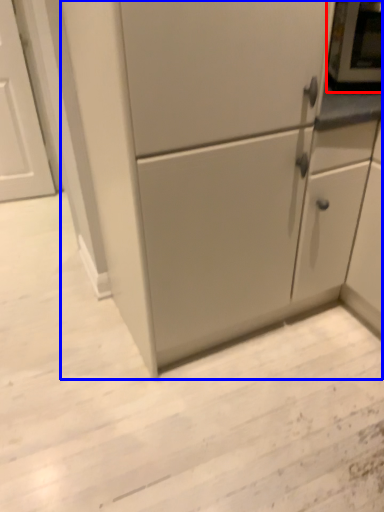
Question: Which point is further to the camera, appliance (highlighted by a red box) or cabinetry (highlighted by a blue box)?

Choices:
 (A) appliance
 (B) cabinetry

Answer: (A)